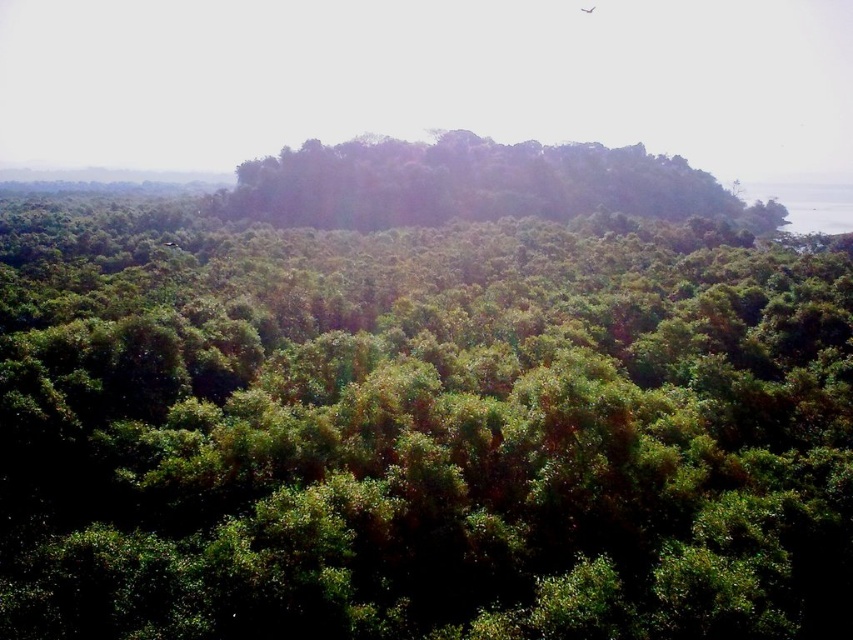
Question: Which point is farther from the camera taking this photo?

Choices:
 (A) (138, 492)
 (B) (453, 180)

Answer: (B)

Question: Is green leafy forest at center below green leafy trees at center?

Choices:
 (A) yes
 (B) no

Answer: (A)

Question: Can you confirm if green leafy forest at center is wider than green leafy trees at center?

Choices:
 (A) yes
 (B) no

Answer: (B)

Question: Can you confirm if green leafy forest at center is positioned above green leafy trees at center?

Choices:
 (A) no
 (B) yes

Answer: (A)